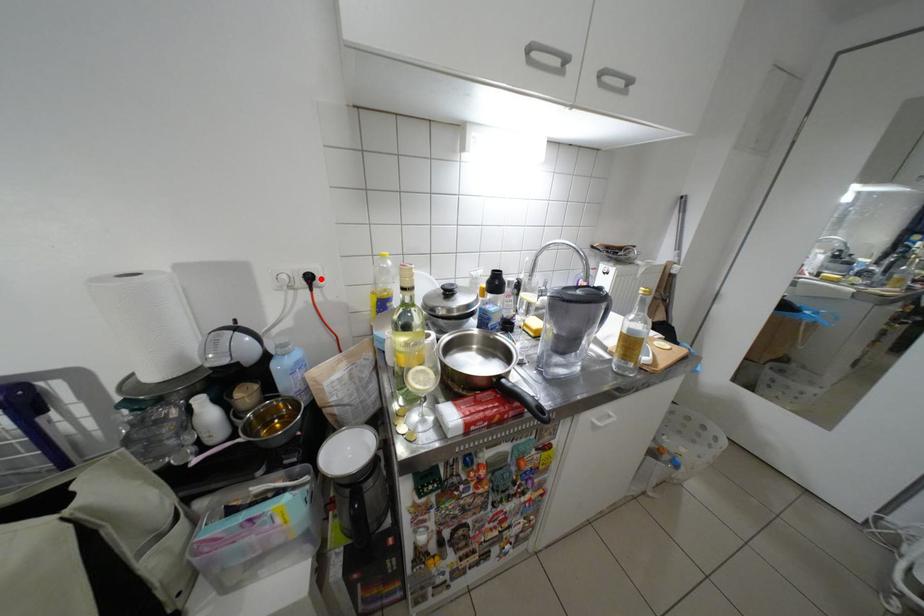
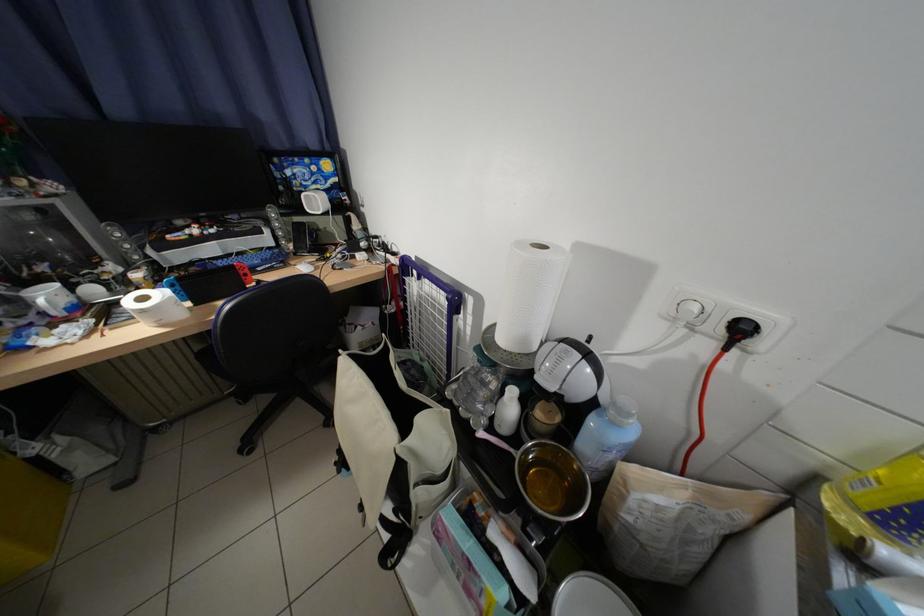
The point at the highlighted location is marked in the first image. Where is the corresponding point in the second image?

(754, 331)